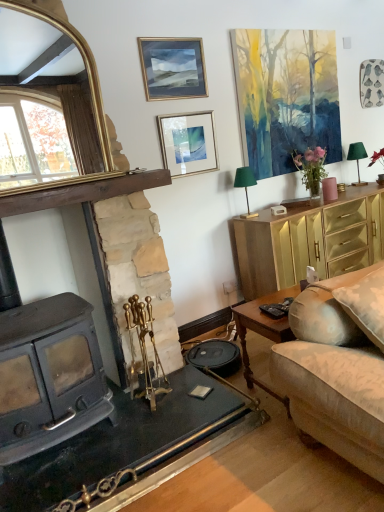
Identify the location of free space to the right of green fabric lampshade at upper right, marked as the 2th lamp in a top-to-bottom arrangement. pyautogui.click(x=270, y=212).